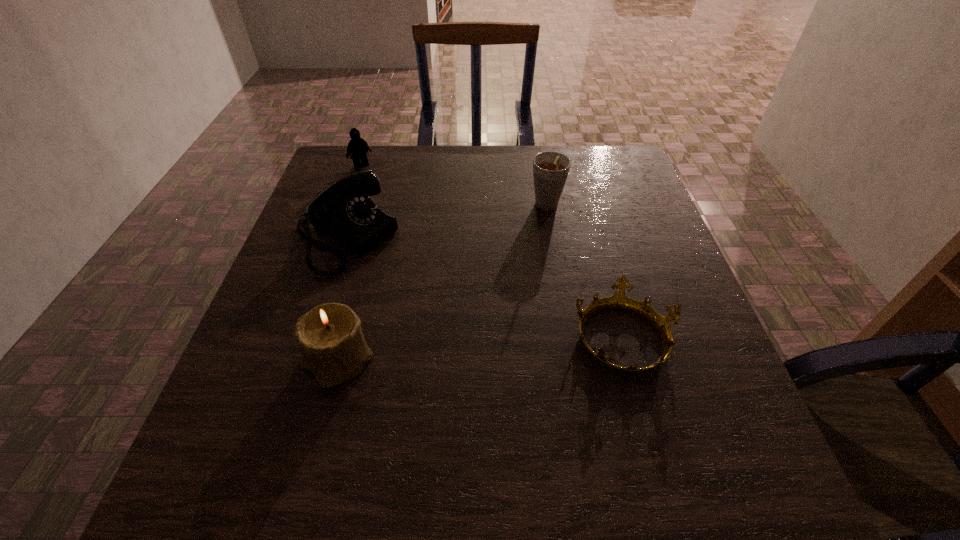
You are a GUI agent. You are given a task and a screenshot of the screen. Output one action in this format:
    pyautogui.click(x=<x>, y=<y>)
    Task: Click on the vacant space located on the dial of the telephone
    
    Given the screenshot: What is the action you would take?
    pyautogui.click(x=452, y=306)

You are a GUI agent. You are given a task and a screenshot of the screen. Output one action in this format:
    pyautogui.click(x=<x>, y=<y>)
    Task: Click on the vacant area located on the face of the farthest object
    This screenshot has width=960, height=540.
    Given the screenshot: What is the action you would take?
    pyautogui.click(x=384, y=192)

Locate an element on the screen. The height and width of the screenshot is (540, 960). vacant space located 0.080m on the face of the farthest object is located at coordinates (377, 183).

Identify the location of free region located on the face of the farthest object. click(x=383, y=190).

What are the coordinates of `free space located on the drink side of the root beer` in the screenshot? It's located at (536, 246).

This screenshot has width=960, height=540. I want to click on vacant position located on the drink side of the root beer, so click(534, 251).

The image size is (960, 540). What are the coordinates of `vacant point located on the drink side of the root beer` in the screenshot? It's located at (531, 257).

Where is `object that is at the far edge`? This screenshot has height=540, width=960. object that is at the far edge is located at coordinates coord(358,147).

The width and height of the screenshot is (960, 540). I want to click on candle_holder that is positioned at the left edge, so click(329, 336).

Find the location of a particular element. The image size is (960, 540). telephone that is at the left edge is located at coordinates (344, 210).